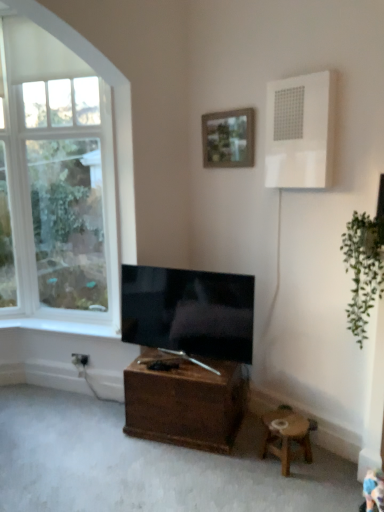
This screenshot has width=384, height=512. Identify the location of vacant space in matte black tv at center (from a real-world perspective). (200, 370).